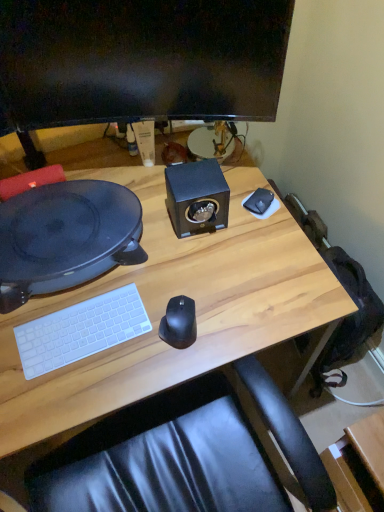
What do you see at coordinates (65, 237) in the screenshot? I see `black plastic record player at left` at bounding box center [65, 237].

Locate an element on the screen. The width and height of the screenshot is (384, 512). black plastic record player at left is located at coordinates pyautogui.click(x=65, y=237).

Where is `white matte mousepad at upper right`? The width and height of the screenshot is (384, 512). white matte mousepad at upper right is located at coordinates (268, 210).

This screenshot has height=512, width=384. What do you see at coordinates (268, 210) in the screenshot?
I see `white matte mousepad at upper right` at bounding box center [268, 210].

In order to face black matte mouse at center, should I rotate leftwards or rightwards?

Turn left by 1.838 degrees to look at black matte mouse at center.

The width and height of the screenshot is (384, 512). What are the coordinates of `matte black monitor at upper center` in the screenshot? It's located at [x=138, y=62].

Does black matte mouse at center come in front of black plastic record player at left?

Yes, it is in front of black plastic record player at left.

Is black matte mouse at center oriented towards black plastic record player at left?

No, black matte mouse at center is not aimed at black plastic record player at left.

Is point (175, 319) less distant than point (73, 216)?

Yes, it is.

Looking at this image, which is more to the left, black matte mouse at center or black plastic record player at left?

black plastic record player at left.

Considering the positions of points (132, 73) and (180, 234), is point (132, 73) farther from camera compared to point (180, 234)?

No, it is in front of (180, 234).

Is matte black monitor at upper center at the right side of black matte speaker at center?

No, matte black monitor at upper center is not to the right of black matte speaker at center.

Is matte black monitor at upper center spatially inside black matte speaker at center, or outside of it?

matte black monitor at upper center is not enclosed by black matte speaker at center.

Consider the image. Which object is thinner, black matte mouse at center or wooden desk at center?

With smaller width is black matte mouse at center.

Is black matte mouse at center facing away from wooden desk at center?

That's not correct — black matte mouse at center is not looking away from wooden desk at center.

Locate an element on the screen. The height and width of the screenshot is (512, 384). desk below the black matte mouse at center (from the image's perspective) is located at coordinates (165, 309).

Is black matte mouse at center touching wooden desk at center?

No, black matte mouse at center is not beside wooden desk at center.

Is black matte speaker at center further to the viewer compared to wooden desk at center?

Yes, it is behind wooden desk at center.

At what (x,y) coordinates should I click in order to perform the action: click on speaker located behind the wooden desk at center. Please return your answer as a coordinate pair (x, y). The height and width of the screenshot is (512, 384). Looking at the image, I should click on (197, 197).

Between black matte speaker at center and wooden desk at center, which one appears on the right side from the viewer's perspective?

black matte speaker at center is more to the right.

Is wooden desk at center in front of white matte mousepad at upper right?

Yes, wooden desk at center is closer to the camera.

Would you say wooden desk at center is outside white matte mousepad at upper right?

Yes, wooden desk at center is located beyond the bounds of white matte mousepad at upper right.

Can you confirm if wooden desk at center is thinner than white matte mousepad at upper right?

No, wooden desk at center is not thinner than white matte mousepad at upper right.

Considering the relative sizes of white matte mousepad at upper right and black plastic record player at left in the image provided, is white matte mousepad at upper right thinner than black plastic record player at left?

Correct, the width of white matte mousepad at upper right is less than that of black plastic record player at left.

Is white matte mousepad at upper right facing towards black plastic record player at left?

No.

Is white matte mousepad at upper right not inside black plastic record player at left?

Yes, white matte mousepad at upper right is outside of black plastic record player at left.

From the image's perspective, is white matte mousepad at upper right above black plastic record player at left?

Indeed, from the image's perspective, white matte mousepad at upper right is shown above black plastic record player at left.

In the scene shown: Is matte black monitor at upper center wider than white matte keyboard at lower left?

No.

Between point (209, 100) and point (121, 329), which one is positioned behind?

The point (209, 100) is behind.

Measure the distance from matte black monitor at upper center to white matte keyboard at lower left.

They are 52.49 centimeters apart.

Is matte black monitor at upper center oriented away from white matte keyboard at lower left?

matte black monitor at upper center is not turned away from white matte keyboard at lower left.

The height and width of the screenshot is (512, 384). I want to click on desktop above the black matte mouse at center (from the image's perspective), so click(65, 237).

Find the location of a particular element. The image size is (384, 512). computer monitor that is in front of the black matte speaker at center is located at coordinates (138, 62).

Looking at the image, which one is located further to white matte keyboard at lower left, black matte speaker at center or matte black monitor at upper center?

matte black monitor at upper center lies further to white matte keyboard at lower left than the other object.

From the image, which object appears to be farther from wooden desk at center, white matte mousepad at upper right or black matte mouse at center?

white matte mousepad at upper right is positioned further to the anchor wooden desk at center.

Looking at the image, which one is located further to white matte keyboard at lower left, black matte mouse at center or wooden desk at center?

wooden desk at center is further to white matte keyboard at lower left.

Which object lies further to the anchor point matte black monitor at upper center, white matte keyboard at lower left or black matte speaker at center?

white matte keyboard at lower left is further to matte black monitor at upper center.

When comparing their distances from black matte mouse at center, does white matte keyboard at lower left or wooden desk at center seem further?

wooden desk at center lies further to black matte mouse at center than the other object.

Considering their positions, is black matte mouse at center positioned closer to wooden desk at center than black matte speaker at center?

black matte speaker at center lies closer to wooden desk at center than the other object.

Based on their spatial positions, is white matte keyboard at lower left or white matte mousepad at upper right further from black matte speaker at center?

white matte keyboard at lower left lies further to black matte speaker at center than the other object.

From the image, which object appears to be farther from white matte keyboard at lower left, matte black monitor at upper center or black matte speaker at center?

matte black monitor at upper center.

You are a GUI agent. You are given a task and a screenshot of the screen. Output one action in this format:
    pyautogui.click(x=<x>, y=<y>)
    Task: Click on the desktop between matte black monitor at upper center and white matte keyboard at lower left in the vertical direction
    
    Given the screenshot: What is the action you would take?
    pyautogui.click(x=65, y=237)

Locate an element on the screen. The height and width of the screenshot is (512, 384). speaker between matte black monitor at upper center and black matte mouse at center in the vertical direction is located at coordinates (197, 197).

At what (x,y) coordinates should I click in order to perform the action: click on speaker between matte black monitor at upper center and white matte mousepad at upper right from front to back. Please return your answer as a coordinate pair (x, y). The height and width of the screenshot is (512, 384). Looking at the image, I should click on (197, 197).

Locate an element on the screen. This screenshot has height=512, width=384. mouse between black matte speaker at center and white matte keyboard at lower left in the up-down direction is located at coordinates (179, 323).